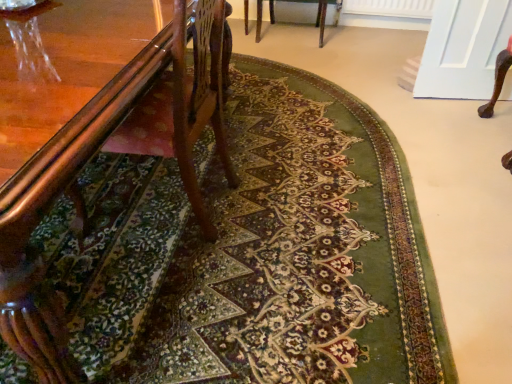
Question: Is wooden chair at center, which is counted as the 2th chair, starting from the left, at the right side of wooden chair at left, which is counted as the first chair, starting from the front?

Choices:
 (A) yes
 (B) no

Answer: (A)

Question: Considering the relative sizes of wooden chair at center, which is the second chair from front to back, and wooden chair at left, the 1th chair when ordered from left to right, in the image provided, is wooden chair at center, which is the second chair from front to back, smaller than wooden chair at left, the 1th chair when ordered from left to right,?

Choices:
 (A) no
 (B) yes

Answer: (B)

Question: From a real-world perspective, is wooden chair at center, which is the first chair in right-to-left order, on top of wooden chair at left, arranged as the 2th chair when viewed from the right?

Choices:
 (A) no
 (B) yes

Answer: (A)

Question: Can you confirm if wooden chair at center, which is counted as the 2th chair, starting from the bottom, is thinner than wooden chair at left, positioned as the 1th chair in bottom-to-top order?

Choices:
 (A) yes
 (B) no

Answer: (A)

Question: Is wooden chair at center, acting as the first chair starting from the back, outside wooden chair at left, positioned as the 1th chair in bottom-to-top order?

Choices:
 (A) no
 (B) yes

Answer: (B)

Question: Is wooden chair at center, which is the second chair from front to back, shorter than wooden chair at left, which is counted as the first chair, starting from the front?

Choices:
 (A) no
 (B) yes

Answer: (B)

Question: Can you confirm if wooden chair at left, the 1th chair when ordered from left to right, is positioned to the left of wooden chair at center, which is the second chair from front to back?

Choices:
 (A) no
 (B) yes

Answer: (B)

Question: Is wooden chair at left, arranged as the second chair when viewed from the top, in contact with wooden chair at center, which is the second chair from front to back?

Choices:
 (A) no
 (B) yes

Answer: (A)

Question: From the image's perspective, would you say wooden chair at left, which is counted as the first chair, starting from the front, is positioned over wooden chair at center, acting as the first chair starting from the back?

Choices:
 (A) yes
 (B) no

Answer: (B)

Question: Is wooden chair at left, the 1th chair when ordered from left to right, thinner than wooden chair at center, acting as the first chair starting from the back?

Choices:
 (A) no
 (B) yes

Answer: (A)

Question: Does wooden chair at left, which is counted as the first chair, starting from the front, come behind wooden chair at center, which is the first chair in right-to-left order?

Choices:
 (A) yes
 (B) no

Answer: (B)

Question: Considering the relative sizes of wooden chair at left, the 1th chair when ordered from left to right, and wooden chair at center, which is counted as the 2th chair, starting from the bottom, in the image provided, is wooden chair at left, the 1th chair when ordered from left to right, taller than wooden chair at center, which is counted as the 2th chair, starting from the bottom,?

Choices:
 (A) yes
 (B) no

Answer: (A)

Question: Considering the positions of wooden chair at center, which is counted as the 2th chair, starting from the bottom, and wooden chair at left, positioned as the 1th chair in bottom-to-top order, in the image, is wooden chair at center, which is counted as the 2th chair, starting from the bottom, taller or shorter than wooden chair at left, positioned as the 1th chair in bottom-to-top order,?

Choices:
 (A) tall
 (B) short

Answer: (B)